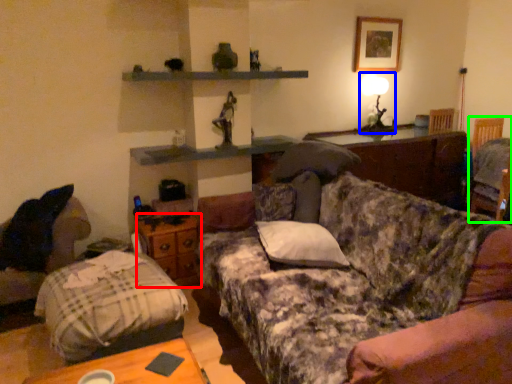
Question: Estimate the real-world distances between objects in this image. Which object is farther from drawer (highlighted by a red box), table lamp (highlighted by a blue box) or swivel chair (highlighted by a green box)?

Choices:
 (A) table lamp
 (B) swivel chair

Answer: (B)